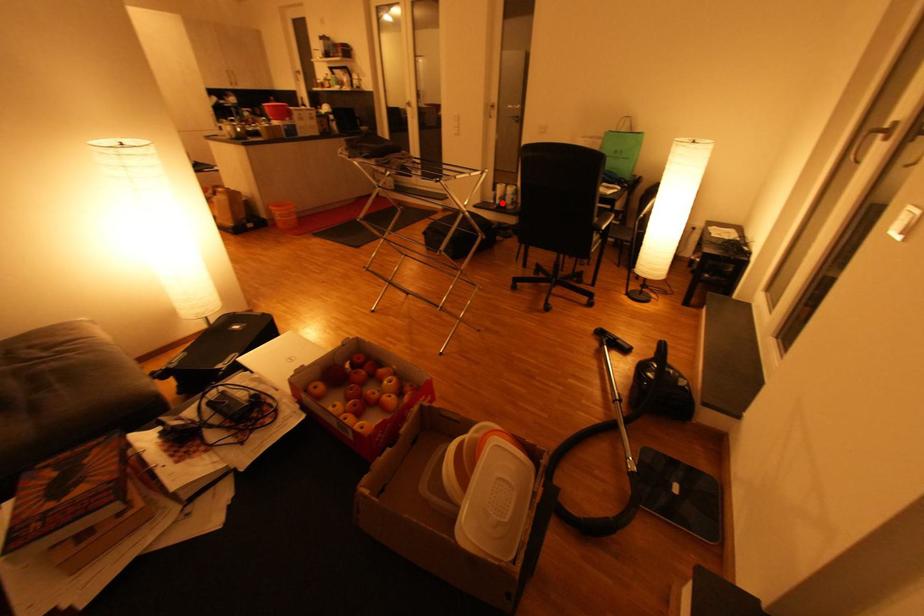
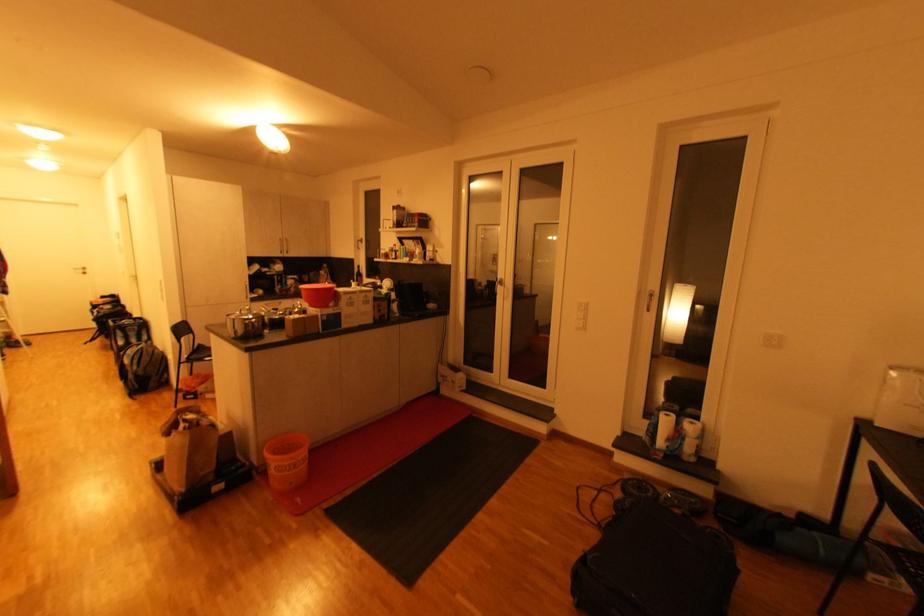
In the second image, find the point that corresponds to the highlighted location in the first image.

(665, 444)